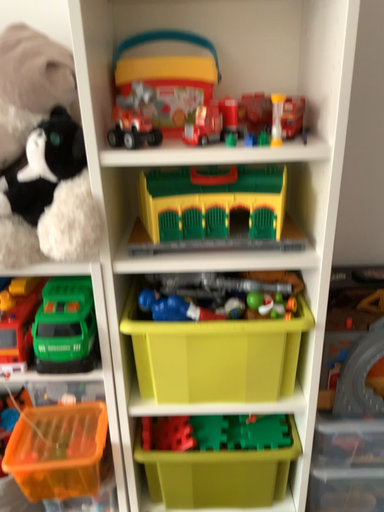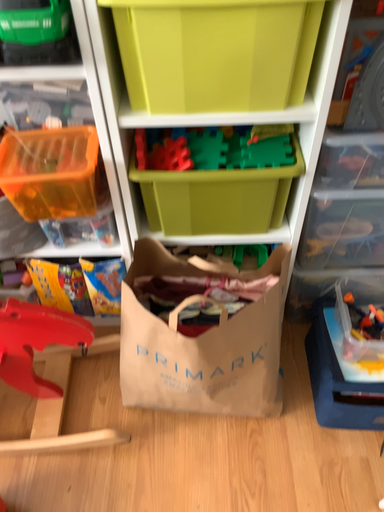
Question: How did the camera likely rotate when shooting the video?

Choices:
 (A) rotated upward
 (B) rotated downward

Answer: (B)